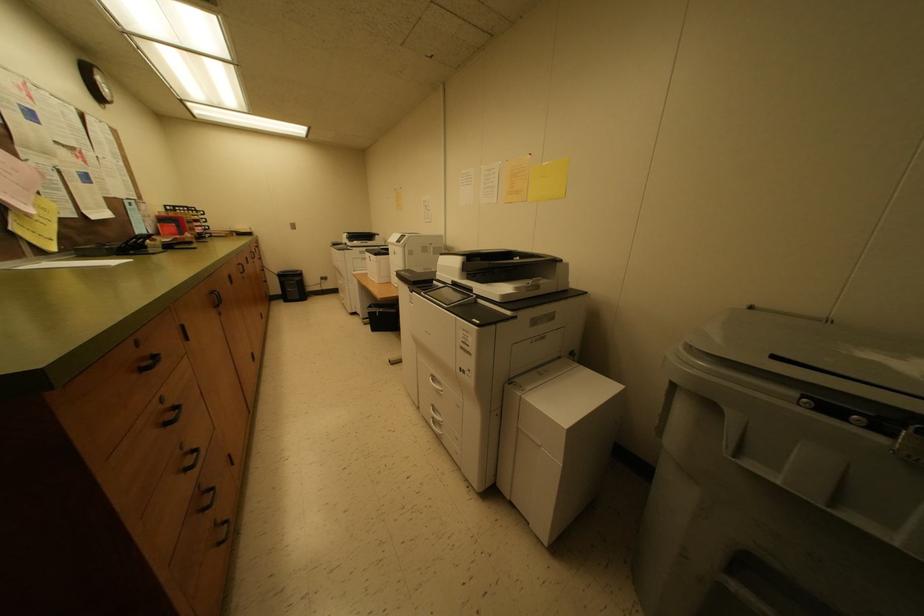
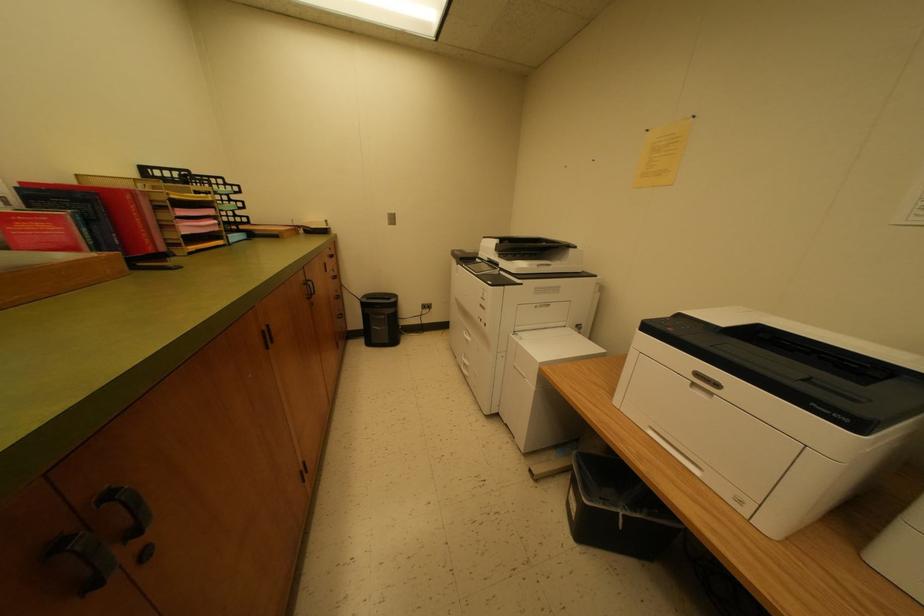
Which direction would the cameraman need to move to produce the second image?

The cameraman walked toward left, forward.